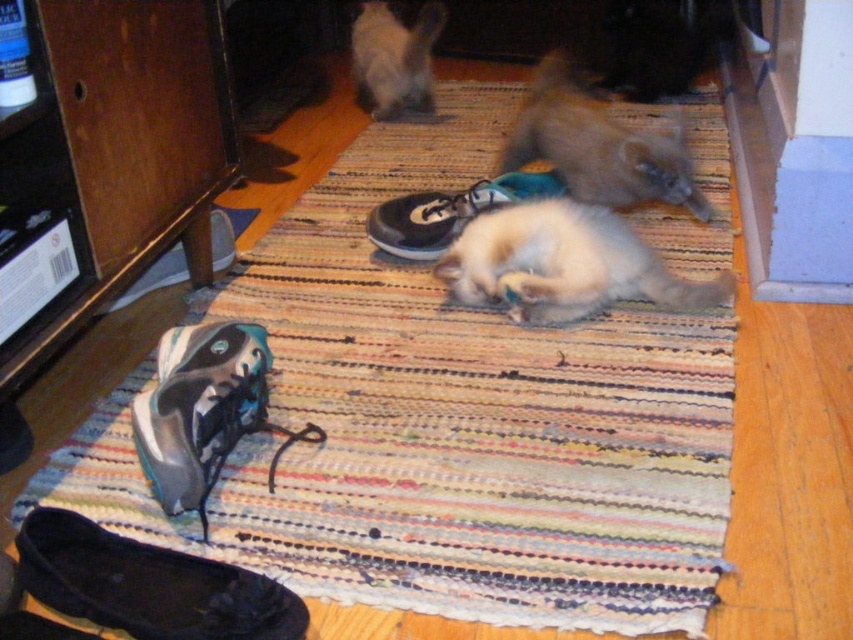
Question: Can you confirm if black suede running shoe at lower left is bigger than fuzzy white cat at upper center?

Choices:
 (A) no
 (B) yes

Answer: (A)

Question: Estimate the real-world distances between objects in this image. Which object is farther from the shiny blue sneaker at lower left?

Choices:
 (A) fuzzy brown cat at center
 (B) fuzzy white cat at upper center

Answer: (B)

Question: Does black suede running shoe at lower left come behind shiny blue sneaker at lower left?

Choices:
 (A) no
 (B) yes

Answer: (A)

Question: Can you confirm if shiny blue sneaker at lower left is positioned above black suede shoe at center?

Choices:
 (A) yes
 (B) no

Answer: (B)

Question: Which point is farther to the camera?

Choices:
 (A) black suede running shoe at lower left
 (B) fluffy white cat at center
 (C) shiny blue sneaker at lower left

Answer: (B)

Question: Estimate the real-world distances between objects in this image. Which object is farther from the fuzzy brown cat at center?

Choices:
 (A) fluffy white cat at center
 (B) black suede shoe at center
 (C) black suede running shoe at lower left

Answer: (C)